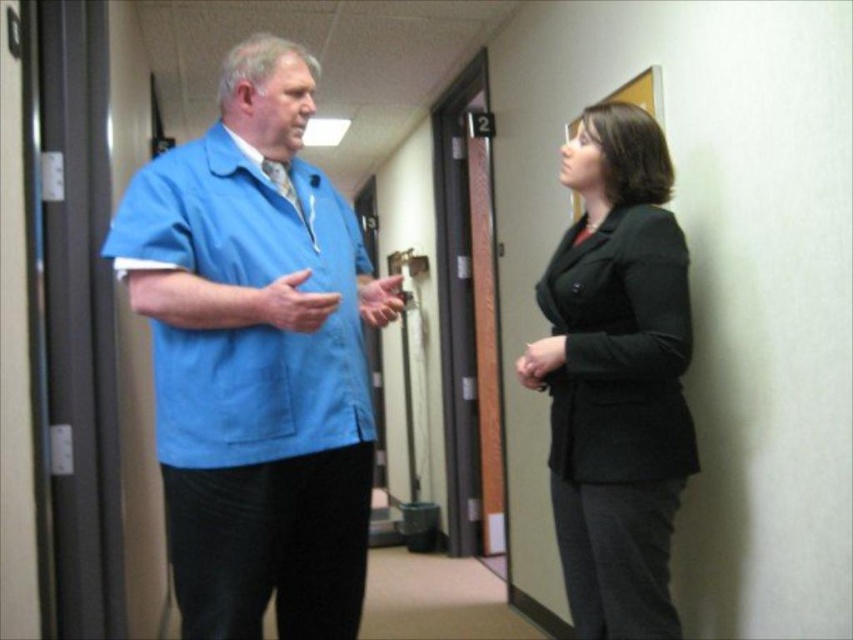
Looking at this image, does blue fabric shirt at center appear on the right side of black matte blazer at right?

In fact, blue fabric shirt at center is to the left of black matte blazer at right.

Does blue fabric shirt at center have a smaller size compared to black matte blazer at right?

No.

Does point (223, 401) lie in front of point (612, 131)?

Yes, point (223, 401) is closer to viewer.

Find the location of `blue fabric shirt at center`. blue fabric shirt at center is located at coordinates (256, 358).